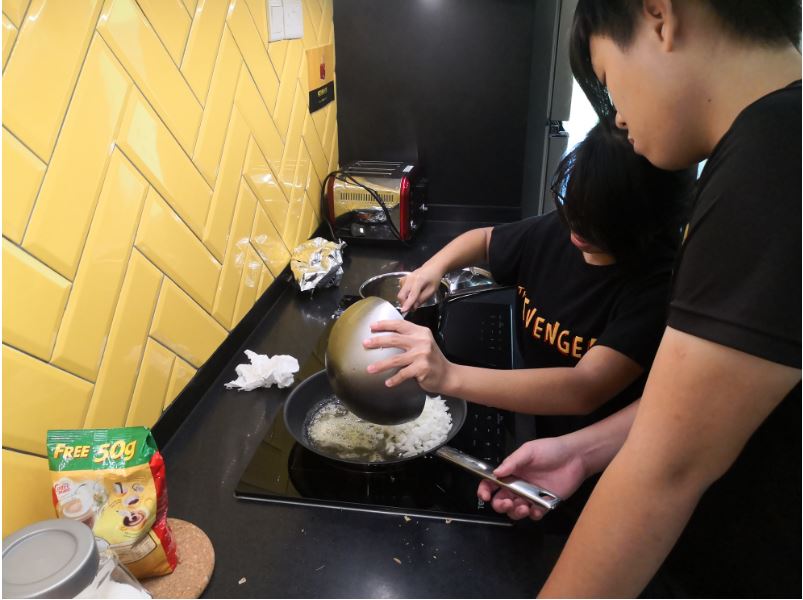
Locate an element on the screen. This screenshot has height=600, width=803. skillet is located at coordinates (314, 395).